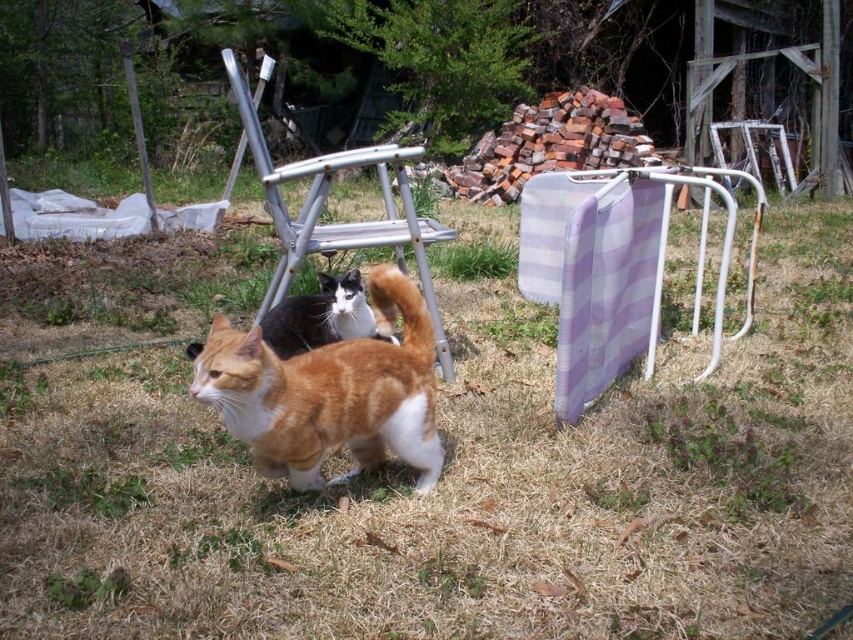
Question: Which of the following is the closest to the observer?

Choices:
 (A) orange and white fur cat at center
 (B) purple checkered fabric at center
 (C) white metal folding chair at upper right
 (D) orange tabby cat at center

Answer: (A)

Question: Is metallic silver chair at center thinner than white metal folding chair at upper right?

Choices:
 (A) no
 (B) yes

Answer: (B)

Question: Observing the image, what is the correct spatial positioning of purple checkered fabric at center in reference to metallic silver chair at center?

Choices:
 (A) left
 (B) right

Answer: (B)

Question: Can you confirm if orange and white fur cat at center is positioned to the right of white metal folding chair at upper right?

Choices:
 (A) yes
 (B) no

Answer: (B)

Question: Which point appears farthest from the camera in this image?

Choices:
 (A) (306, 164)
 (B) (647, 490)

Answer: (A)

Question: Which object is closer to the camera taking this photo?

Choices:
 (A) metallic silver chair at center
 (B) orange tabby cat at center
 (C) white metal folding chair at upper right

Answer: (A)